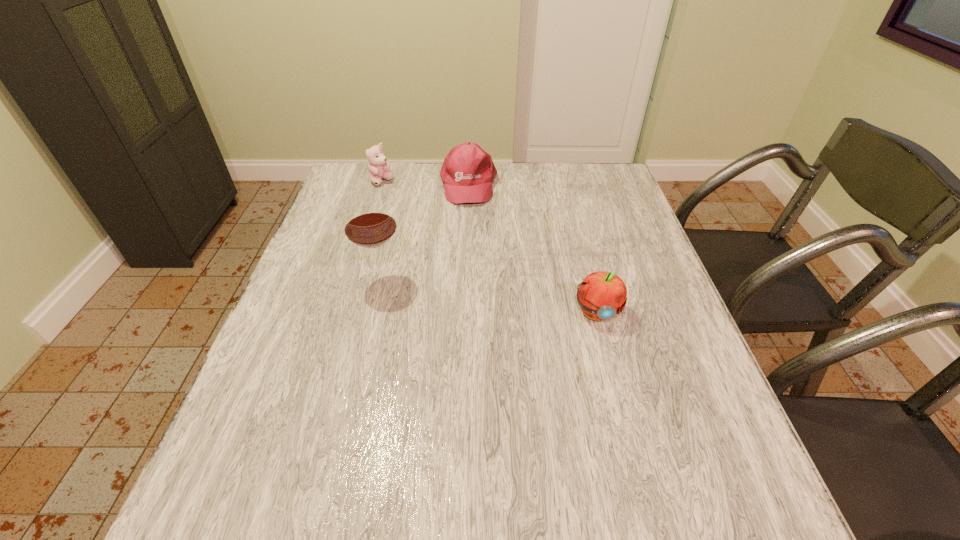
Where is `the tallest object`? This screenshot has width=960, height=540. the tallest object is located at coordinates (369, 223).

At what (x,y) coordinates should I click in order to perform the action: click on the rightmost object. Please return your answer as a coordinate pair (x, y). This screenshot has width=960, height=540. Looking at the image, I should click on (602, 295).

The image size is (960, 540). What are the coordinates of `baseball cap` in the screenshot? It's located at (467, 173).

Where is `teddy bear`? teddy bear is located at coordinates [378, 166].

At what (x,y) coordinates should I click in order to perform the action: click on vacant space situated on the front of the wineglass. Please return your answer as a coordinate pair (x, y). Looking at the image, I should click on (367, 340).

Image resolution: width=960 pixels, height=540 pixels. Find the location of `vacant space situated 0.270m on the surface of the rightmost object`. vacant space situated 0.270m on the surface of the rightmost object is located at coordinates (631, 446).

I want to click on blank space located 0.360m at the front of the baseball cap with the brim, so click(473, 292).

The image size is (960, 540). Identify the location of free space located at the front of the baseball cap with the brim. (472, 262).

Where is `vacant space situated at the front of the baseball cap with the brim`? The height and width of the screenshot is (540, 960). vacant space situated at the front of the baseball cap with the brim is located at coordinates (470, 230).

Identify the location of blank space located 0.340m at the face of the teddy bear. (438, 243).